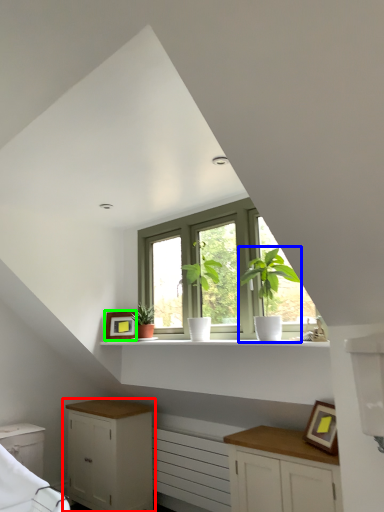
Question: Which object is the farthest from cabinetry (highlighted by a red box)? Choose among these: houseplant (highlighted by a blue box) or picture frame (highlighted by a green box).

Choices:
 (A) houseplant
 (B) picture frame

Answer: (A)